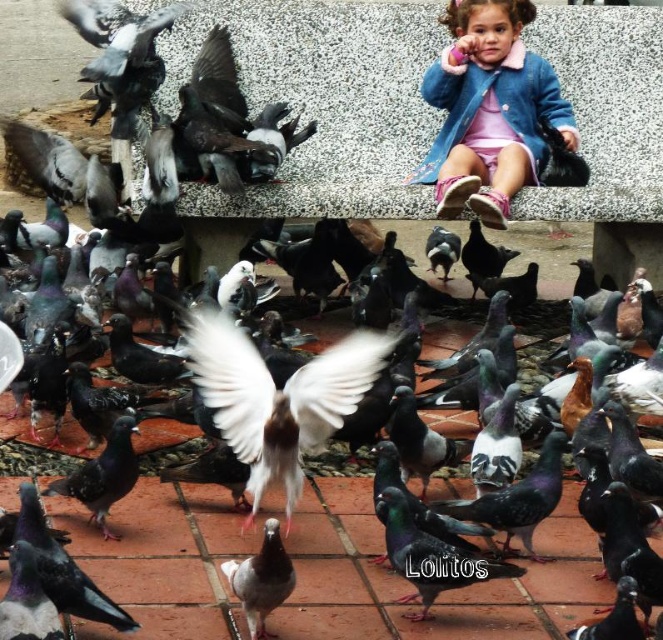
Question: From the image, what is the correct spatial relationship of white glossy bird at center in relation to speckled feathered pigeon at center?

Choices:
 (A) above
 (B) below

Answer: (A)

Question: Among these points, which one is farthest from the camera?

Choices:
 (A) (408, 525)
 (B) (322, 372)

Answer: (B)

Question: In this image, where is blue denim jacket at upper right located relative to speckled feathered pigeon at center?

Choices:
 (A) left
 (B) right

Answer: (B)

Question: Can you confirm if white glossy bird at center is positioned to the right of speckled feathered pigeon at center?

Choices:
 (A) no
 (B) yes

Answer: (A)

Question: Which object appears farthest from the camera in this image?

Choices:
 (A) white glossy pigeon at center
 (B) white glossy bird at center
 (C) speckled feathered pigeon at center
 (D) blue denim jacket at upper right

Answer: (D)

Question: Which of the following is the closest to the observer?

Choices:
 (A) white glossy pigeon at center
 (B) speckled feathered pigeon at center
 (C) blue denim jacket at upper right

Answer: (A)